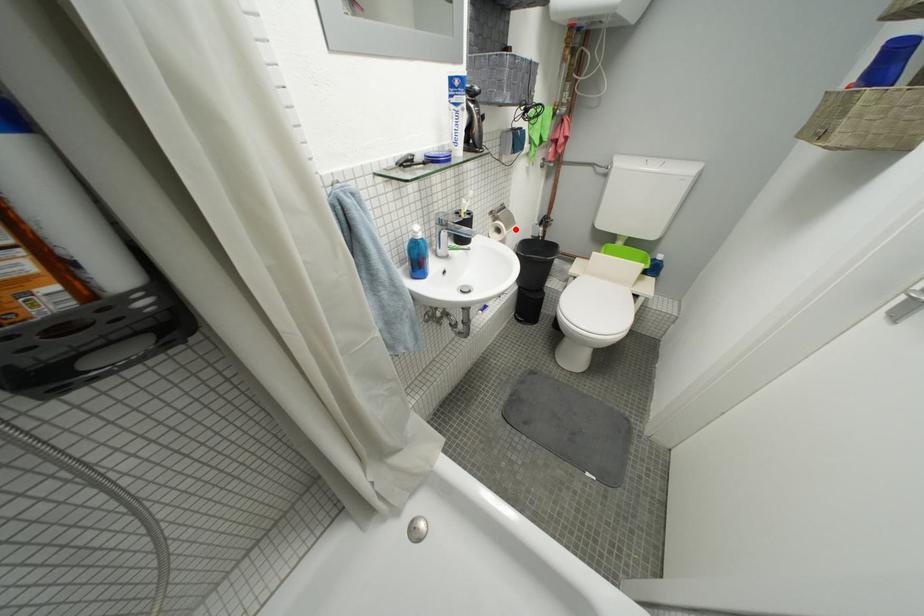
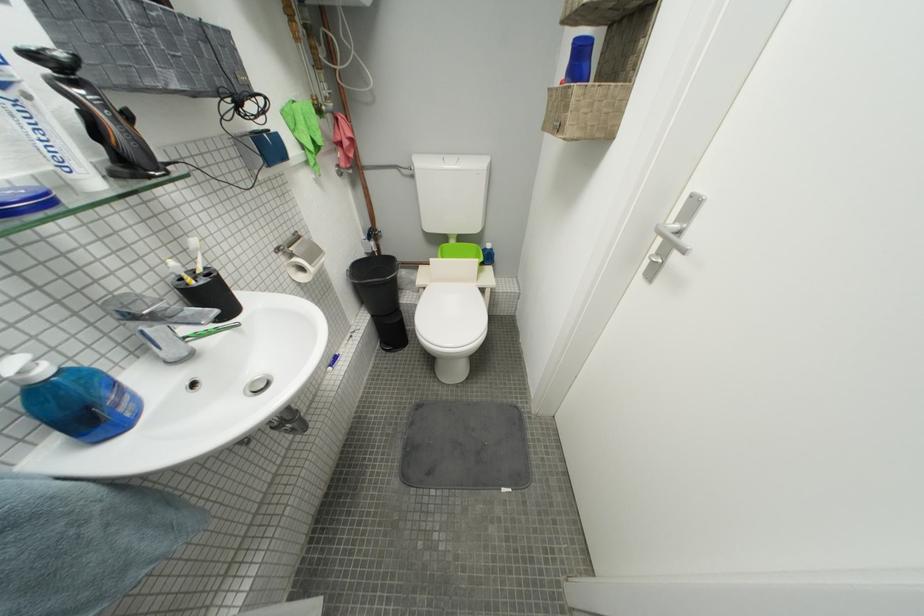
Locate, in the second image, the point that corresponds to the highlighted location in the first image.

(320, 265)